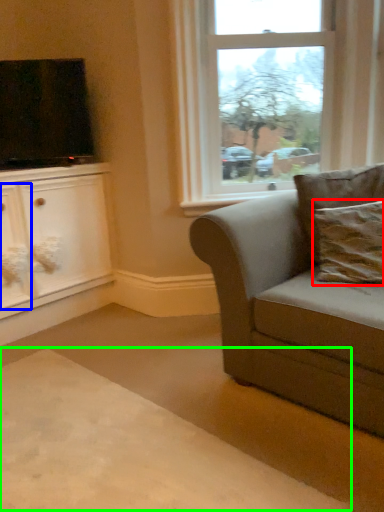
Question: Estimate the real-world distances between objects in this image. Which object is closer to pillow (highlighted by a red box), drawer (highlighted by a blue box) or plain (highlighted by a green box)?

Choices:
 (A) drawer
 (B) plain

Answer: (B)